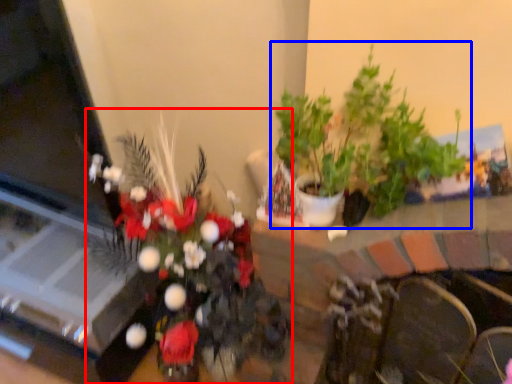
Question: Which point is closer to the camera, houseplant (highlighted by a red box) or houseplant (highlighted by a blue box)?

Choices:
 (A) houseplant
 (B) houseplant

Answer: (A)